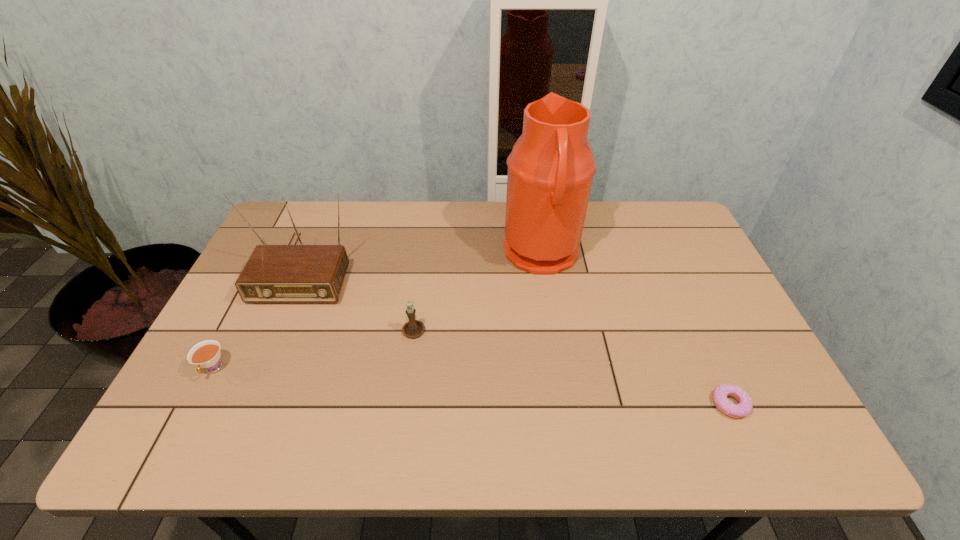
The height and width of the screenshot is (540, 960). In order to click on vacant area at the far left corner of the desktop in this screenshot , I will do `click(270, 234)`.

The image size is (960, 540). Identify the location of vacant space at the far right corner of the desktop. (637, 205).

Locate an element on the screen. Image resolution: width=960 pixels, height=540 pixels. vacant region between the second nearest object and the second tallest object is located at coordinates [259, 318].

The height and width of the screenshot is (540, 960). I want to click on free area in between the shortest object and the second tallest object, so click(x=517, y=335).

Locate an element on the screen. This screenshot has height=540, width=960. free space between the third farthest object and the shortest object is located at coordinates (571, 366).

At what (x,y) coordinates should I click in order to perform the action: click on vacant area between the second object from right to left and the third farthest object. Please return your answer as a coordinate pair (x, y). Looking at the image, I should click on (478, 292).

The image size is (960, 540). I want to click on free area in between the second nearest object and the third farthest object, so click(314, 348).

You are a GUI agent. You are given a task and a screenshot of the screen. Output one action in this format:
    pyautogui.click(x=<x>, y=<y>)
    Task: Click on the free spot between the water jug and the teacup
    The height and width of the screenshot is (540, 960).
    Given the screenshot: What is the action you would take?
    377,312

This screenshot has width=960, height=540. Identify the location of free spot between the second tallest object and the rightmost object. (517, 335).

The image size is (960, 540). In order to click on vacant region between the fourth farthest object and the fourth object from left to right in this screenshot , I will do `click(377, 312)`.